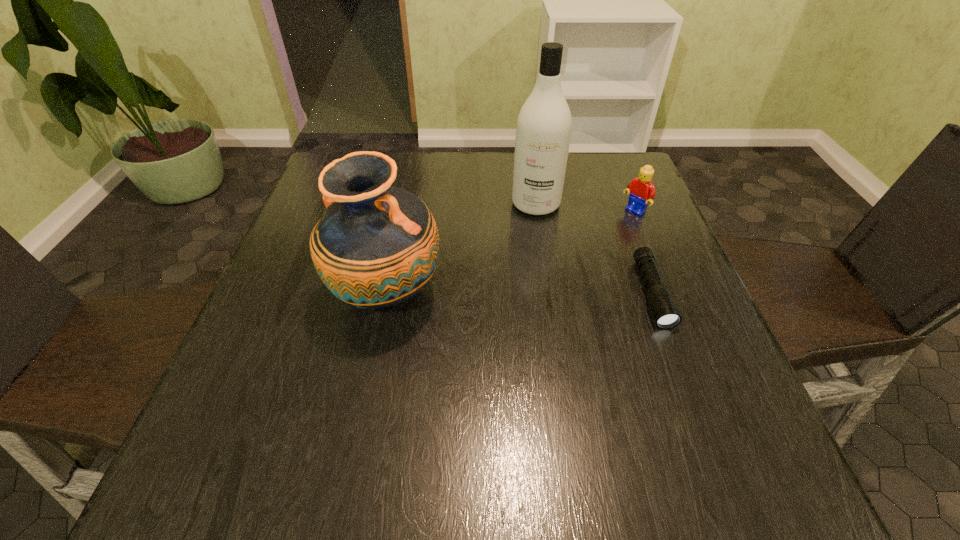
Find the location of a particular element. This screenshot has height=540, width=960. the leftmost object is located at coordinates (376, 246).

Identify the location of pottery. (376, 246).

Find the location of a particular element. flashlight is located at coordinates (666, 315).

I want to click on the second shortest object, so click(641, 189).

Identify the location of shampoo. (544, 124).

The image size is (960, 540). In order to click on the tallest object in this screenshot , I will do `click(544, 124)`.

Locate an element on the screen. The height and width of the screenshot is (540, 960). free spot located on the back of the leftmost object is located at coordinates (406, 200).

Image resolution: width=960 pixels, height=540 pixels. What are the coordinates of `vacant region located 0.130m at the lens end of the flashlight` in the screenshot? It's located at (687, 389).

This screenshot has width=960, height=540. In order to click on vacant space located 0.250m on the front-facing side of the Lego in this screenshot , I will do `click(564, 265)`.

Locate an element on the screen. This screenshot has height=540, width=960. free spot located on the front-facing side of the Lego is located at coordinates (549, 276).